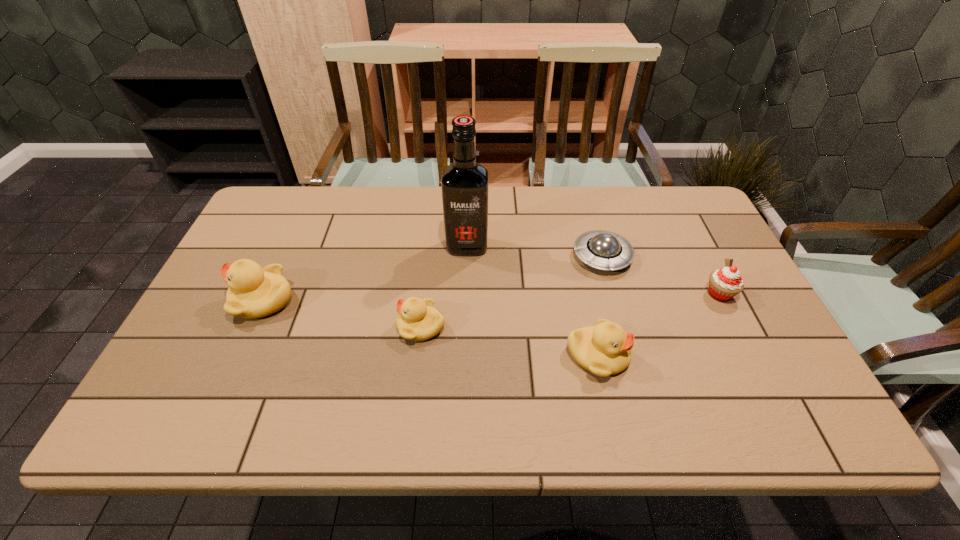
This screenshot has height=540, width=960. Identify the location of free space located 0.390m at the face of the fifth tallest object. (239, 326).

At what (x,y) coordinates should I click in order to perform the action: click on free space located 0.150m at the face of the second shortest duckling. Please return your answer as a coordinate pair (x, y). This screenshot has width=960, height=540. Looking at the image, I should click on (692, 355).

You are a GUI agent. You are given a task and a screenshot of the screen. Output one action in this format:
    pyautogui.click(x=<x>, y=<y>)
    Task: Click on the vacant space located on the left of the rightmost object
    This screenshot has width=960, height=540.
    Given the screenshot: What is the action you would take?
    pyautogui.click(x=651, y=294)

The width and height of the screenshot is (960, 540). What are the coordinates of `vacant space located 0.300m on the front-facing side of the liquor` in the screenshot? It's located at (464, 344).

Identify the location of vacant region located on the right of the shortest object. This screenshot has width=960, height=540. [726, 256].

Identify the location of object located in the near edge section of the desktop. The height and width of the screenshot is (540, 960). (605, 349).

Locate an element on the screen. The height and width of the screenshot is (540, 960). object that is at the left edge is located at coordinates (253, 292).

Locate an element on the screen. object situated at the right edge is located at coordinates (725, 283).

Locate an element on the screen. This screenshot has width=960, height=540. vacant space at the far edge of the desktop is located at coordinates (628, 200).

In the image, there is a desktop. At what (x,y) coordinates should I click in order to perform the action: click on vacant space at the near edge. Please return your answer as a coordinate pair (x, y). The width and height of the screenshot is (960, 540). Looking at the image, I should click on (569, 380).